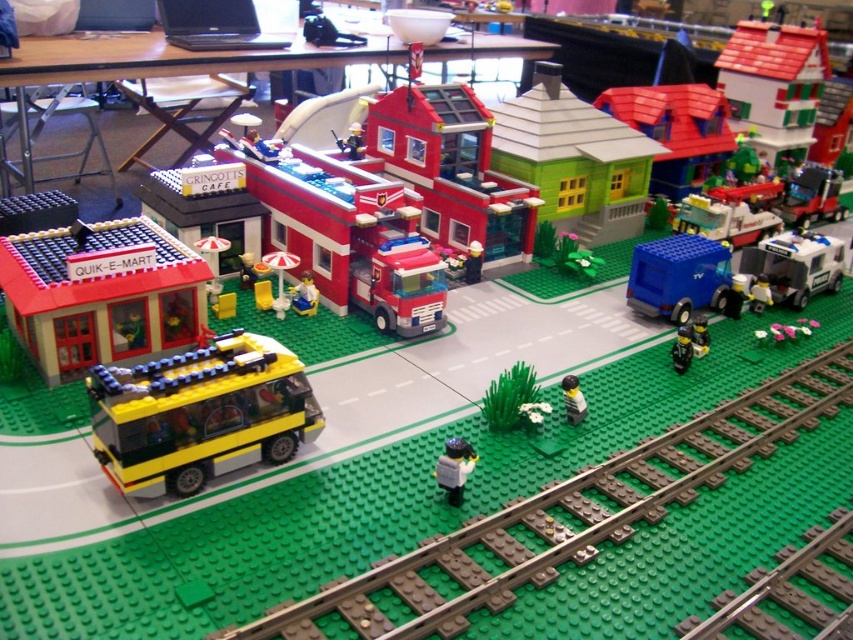
Question: In this image, where is green plastic train track at lower center located relative to smooth plastic house at upper center?

Choices:
 (A) right
 (B) left

Answer: (B)

Question: Is green plastic train track at lower center wider than smooth plastic house at upper center?

Choices:
 (A) no
 (B) yes

Answer: (B)

Question: Which of these objects is positioned closest to the smooth plastic minifigure at center?

Choices:
 (A) yellow matte van at lower left
 (B) yellow matte bus at lower left
 (C) blue plastic van at center-right

Answer: (B)

Question: Is white plastic food truck at right to the right of metallic silver food truck at center-right from the viewer's perspective?

Choices:
 (A) no
 (B) yes

Answer: (B)

Question: Among these points, which one is farthest from the camera?

Choices:
 (A) (457, 468)
 (B) (805, 301)

Answer: (B)

Question: Among these objects, which one is nearest to the camera?

Choices:
 (A) green matte house at center
 (B) yellow matte bus at lower left
 (C) black plastic figure at lower right

Answer: (B)